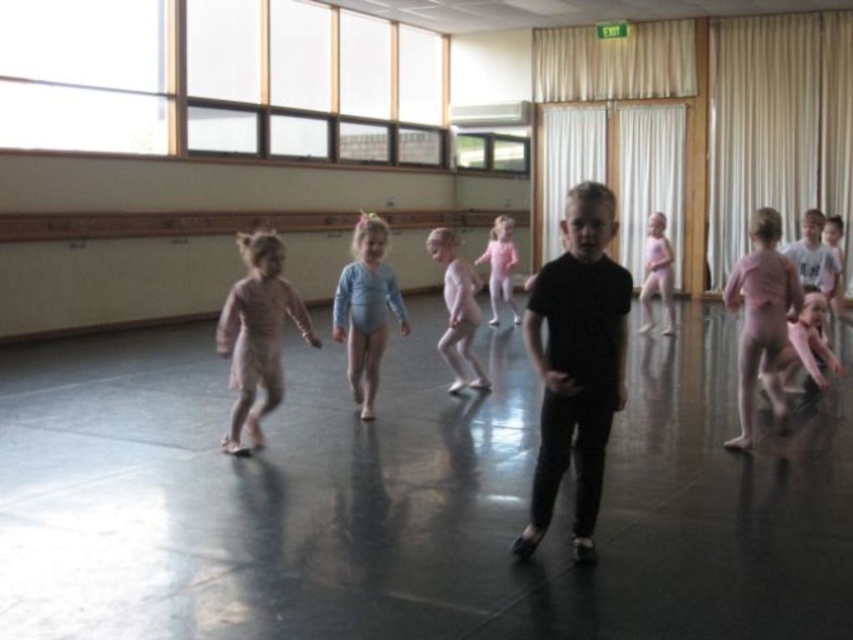
Question: Which point is farther to the camera?

Choices:
 (A) (439, 346)
 (B) (242, 243)

Answer: (A)

Question: Does pink matte leotard at right appear over pink leotard at center?

Choices:
 (A) yes
 (B) no

Answer: (B)

Question: Does pink matte leotard at right have a greater width compared to pink satin leotard at center?

Choices:
 (A) yes
 (B) no

Answer: (A)

Question: From the image, what is the correct spatial relationship of pink satin dress at center in relation to pink satin leotard at center?

Choices:
 (A) above
 (B) below

Answer: (B)

Question: Which point appears farthest from the camera in this image?

Choices:
 (A) (583, 552)
 (B) (480, 372)
 (C) (363, 240)

Answer: (B)

Question: Among these points, which one is farthest from the camera?

Choices:
 (A) tap(380, 337)
 (B) tap(491, 259)
 (C) tap(558, 339)

Answer: (B)